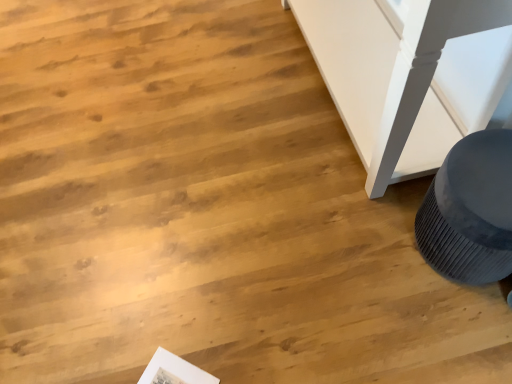
Locate an element on the screen. The height and width of the screenshot is (384, 512). free space behind white paper at lower left is located at coordinates (160, 327).